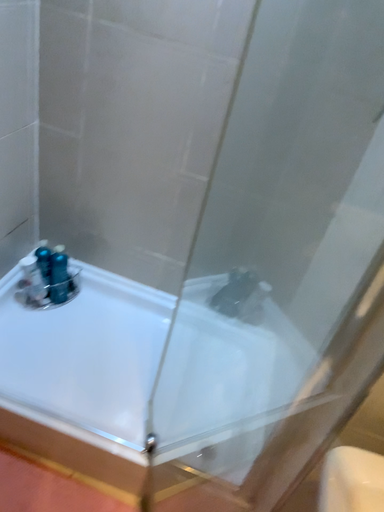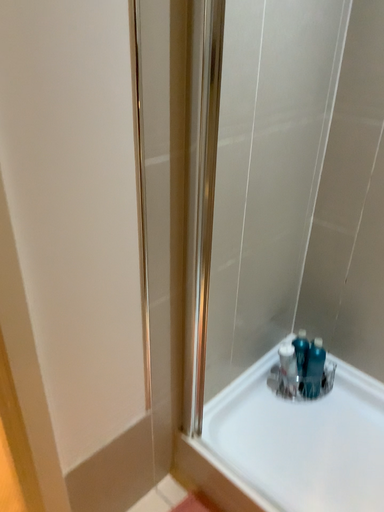
Question: How did the camera likely rotate when shooting the video?

Choices:
 (A) rotated left
 (B) rotated right

Answer: (A)